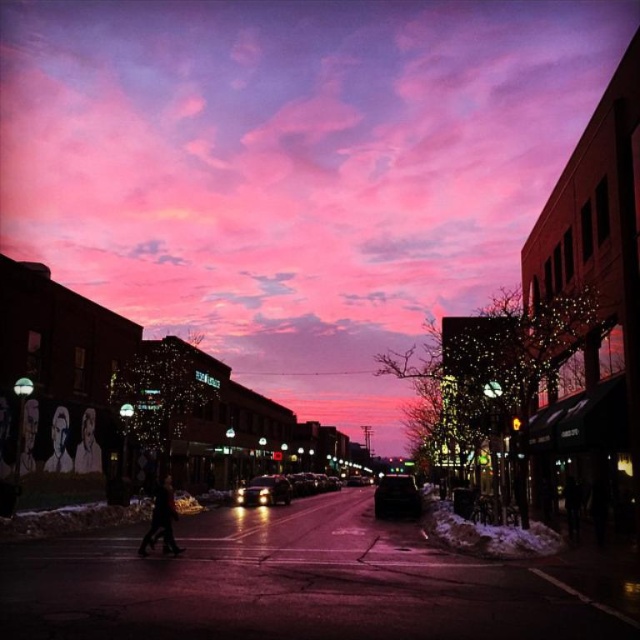
Does glossy black car at center appear on the right side of shiny silver sedan at center?

Indeed, glossy black car at center is positioned on the right side of shiny silver sedan at center.

Does glossy black car at center come behind shiny silver sedan at center?

No, glossy black car at center is closer to the viewer.

Where is `glossy black car at center`? The image size is (640, 640). glossy black car at center is located at coordinates (396, 497).

Locate an element on the screen. glossy black car at center is located at coordinates [x=396, y=497].

Between shiny silver sedan at center and smooth skin figure at lower left, which one has more height?

Standing taller between the two is shiny silver sedan at center.

Who is positioned more to the left, shiny silver sedan at center or smooth skin figure at lower left?

Positioned to the left is smooth skin figure at lower left.

Where is `shiny silver sedan at center`? The width and height of the screenshot is (640, 640). shiny silver sedan at center is located at coordinates (264, 490).

Where is `shiny silver sedan at center`? This screenshot has height=640, width=640. shiny silver sedan at center is located at coordinates (264, 490).

Locate an element on the screen. This screenshot has height=640, width=640. dark fabric figure at center is located at coordinates (161, 520).

The width and height of the screenshot is (640, 640). Describe the element at coordinates (161, 520) in the screenshot. I see `dark fabric figure at center` at that location.

Does point (157, 528) lie in front of point (253, 480)?

Yes.

Identify the location of dark fabric figure at center. The image size is (640, 640). (161, 520).